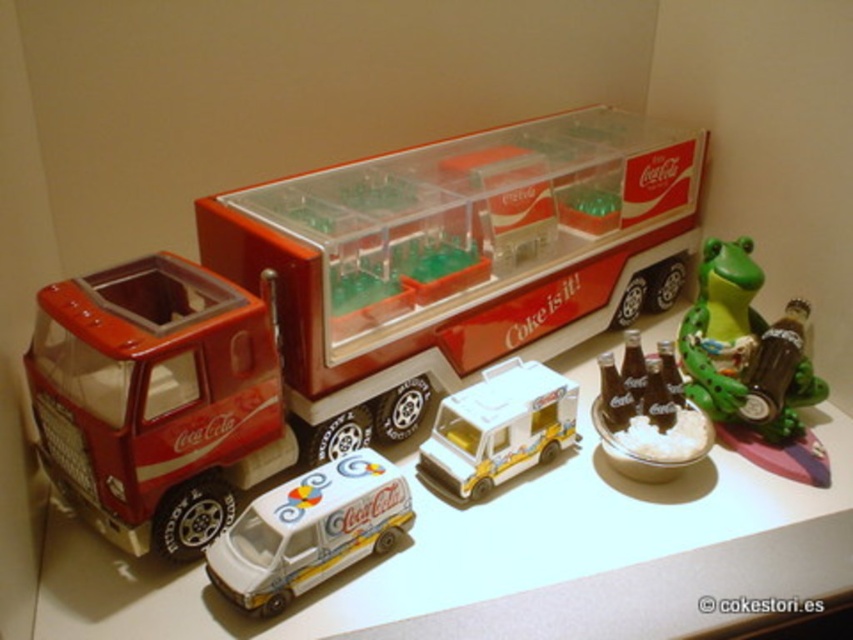
You are organizing a Coca Cola themed event and need to place a white glossy ice cream truck at center on a white glossy table at center. Given that the table is larger than the truck, will the truck fit on the table without overhanging?

The white glossy table at center is larger in size than the white glossy ice cream truck at center, so the truck will fit on the table without overhanging.

You are a customer standing in front of the white glossy table at center and the white glossy ice cream truck at center. Which object is nearer to you?

The white glossy table at center is closer to the viewer than the white glossy ice cream truck at center.

You are standing at the position of point [712,323] and want to move towards the toy truck. Is the point [555,451] blocking your path?

Point [555,451] is in front of point [712,323], so yes, the point [555,451] is blocking your path to the toy truck.